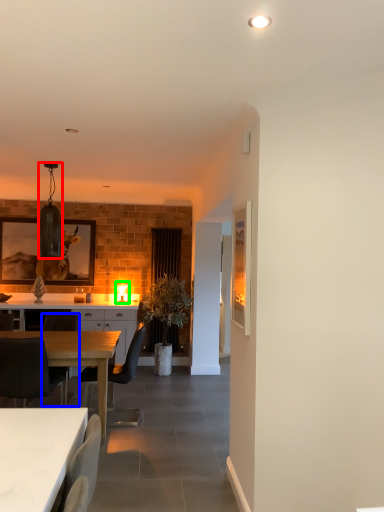
Question: Which object is the farthest from lamp (highlighted by a red box)? Choose among these: chair (highlighted by a blue box) or lamp (highlighted by a green box).

Choices:
 (A) chair
 (B) lamp

Answer: (B)